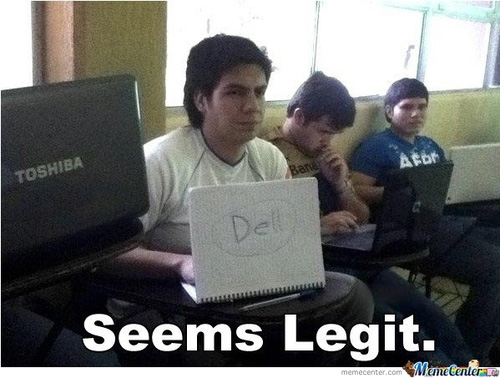
You are a GUI agent. You are given a task and a screenshot of the screen. Output one action in this format:
    pyautogui.click(x=<x>, y=<y>)
    Task: Click on the pen
    The width and height of the screenshot is (500, 378).
    Given the screenshot: What is the action you would take?
    pyautogui.click(x=281, y=297)